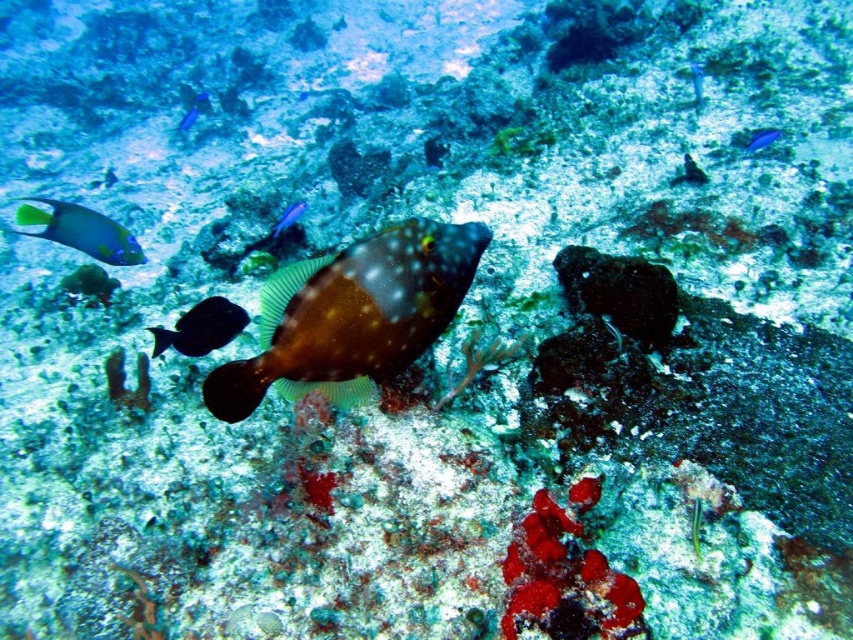
You are a marine biologist observing this underwater scene. You notice the brown glossy fish at center and the blue glossy fish at upper center. Which fish would cast a larger shadow on the seabed below?

The brown glossy fish at center is bigger than the blue glossy fish at upper center, so it would cast a larger shadow on the seabed below.

From the picture: You are a marine biologist observing an underwater scene. You need to determine if a remotely operated vehicle that is 4 feet long can navigate between the brown glossy fish at center and the blue glossy fish at upper center. Can it fit through the space between them?

The distance between the brown glossy fish at center and the blue glossy fish at upper center is 5.29 feet. Since the remotely operated vehicle is 4 feet long, it can fit through the space between them as the distance is greater than the vehicle length.

You are a scuba diver swimming in the underwater scene. You see two points marked in the image. Which point is closer to you, point (x=102, y=221) or point (x=773, y=131)?

Point (x=102, y=221) is closer to you than point (x=773, y=131) because it is further to the viewer.